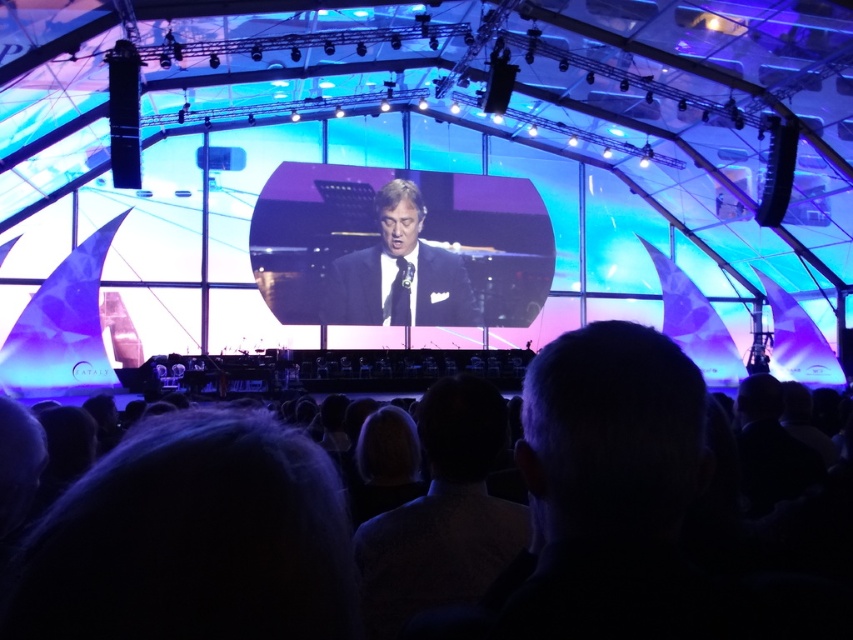
You are a photographer at the event and need to capture a closeup of the black silk suit at center from where you are standing. Given that your camera has a maximum zoom range of 100 feet, can you get a clear shot?

The distance between you and the black silk suit at center is 113.11 feet, which exceeds the camera maximum zoom range of 100 feet. Therefore, you cannot get a clear shot.